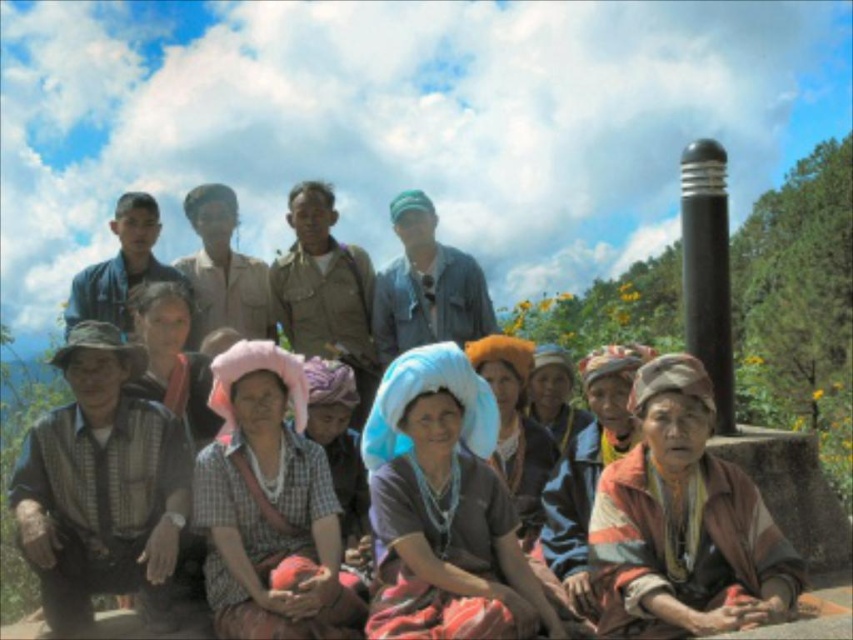
Which of these two, matte blue fabric headscarf at center or blue fabric headscarf at center, stands shorter?

blue fabric headscarf at center

Which is behind, point (524, 580) or point (483, 340)?

Positioned behind is point (483, 340).

At what (x,y) coordinates should I click in order to perform the action: click on matte blue fabric headscarf at center. Please return your answer as a coordinate pair (x, y). Image resolution: width=853 pixels, height=640 pixels. Looking at the image, I should click on (444, 508).

Which is more to the right, matte blue fabric headscarf at center or matte blue headscarf at center?

From the viewer's perspective, matte blue fabric headscarf at center appears more on the right side.

Does matte blue fabric headscarf at center appear over matte blue headscarf at center?

Actually, matte blue fabric headscarf at center is below matte blue headscarf at center.

Is point (468, 417) positioned in front of point (202, 390)?

Yes, point (468, 417) is in front of point (202, 390).

The width and height of the screenshot is (853, 640). I want to click on matte blue fabric headscarf at center, so pos(444,508).

Between matte blue fabric headscarf at center and striped fabric headscarf at lower right, which one appears on the right side from the viewer's perspective?

striped fabric headscarf at lower right is more to the right.

Can you confirm if matte blue fabric headscarf at center is positioned to the right of striped fabric headscarf at lower right?

In fact, matte blue fabric headscarf at center is to the left of striped fabric headscarf at lower right.

Is point (526, 595) behind point (584, 512)?

No, (526, 595) is closer to viewer.

At what (x,y) coordinates should I click in order to perform the action: click on matte blue fabric headscarf at center. Please return your answer as a coordinate pair (x, y). This screenshot has height=640, width=853. Looking at the image, I should click on (444, 508).